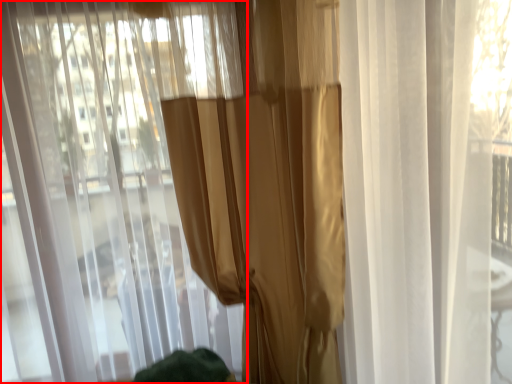
Question: In this image, where is curtain (annotated by the red box) located relative to curtain?

Choices:
 (A) left
 (B) right

Answer: (A)